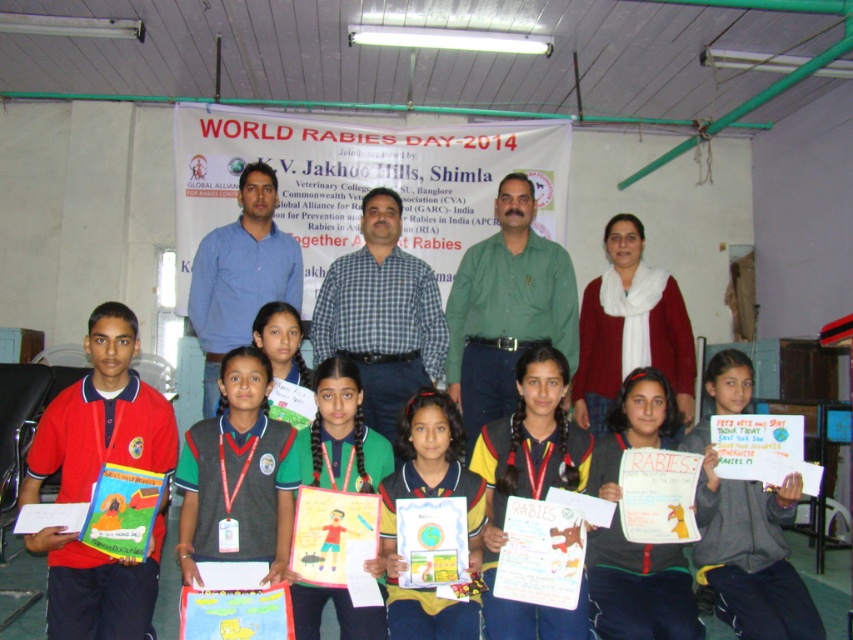
Question: Can you confirm if white paper poster at lower right is positioned below yellow fabric poster at center?

Choices:
 (A) no
 (B) yes

Answer: (B)

Question: Which point is farther to the camera?

Choices:
 (A) white paper poster at lower right
 (B) green fabric uniform at center
 (C) yellow fabric poster at center

Answer: (B)

Question: Which of the following is the closest to the observer?

Choices:
 (A) green fabric uniform at center
 (B) white paper poster at center

Answer: (B)

Question: Is white paper poster at lower right bigger than yellow fabric poster at center?

Choices:
 (A) no
 (B) yes

Answer: (B)

Question: In this image, where is white paper poster at lower right located relative to yellow uniform at center?

Choices:
 (A) right
 (B) left

Answer: (A)

Question: Which point appears closest to the camera in this image?

Choices:
 (A) (577, 634)
 (B) (730, 481)
 (C) (321, 400)
 (D) (596, 477)

Answer: (A)